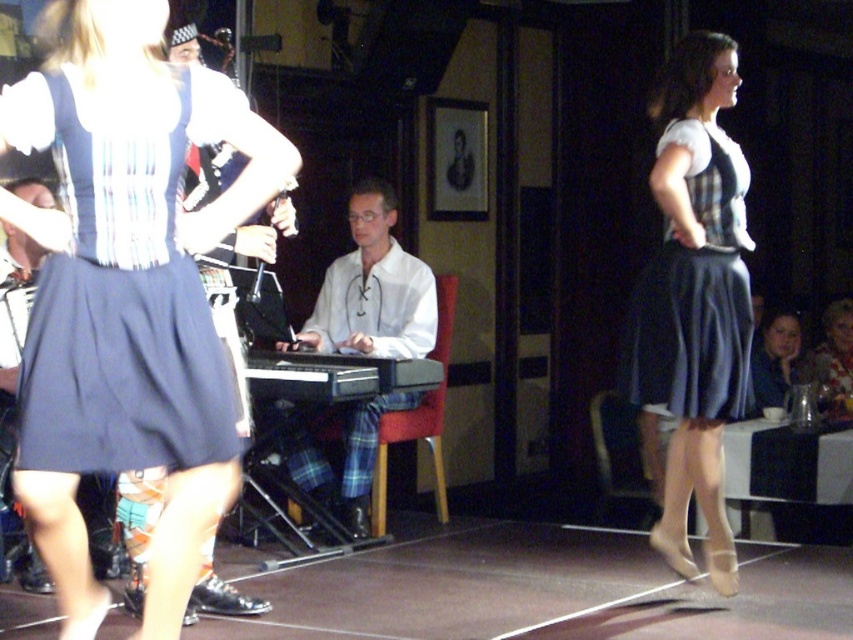
You are standing in the audience watching the dance performance. There are two points marked in the scene. The first point is at coordinates point (683,304) and the second is at point (282,365). Which point is closer to you?

Point (683,304) is closer to the viewer than point (282,365).

You are a photographer at the event and want to capture a photo where the matte black dress at right is visible above the black plastic keyboard at center. Is this possible based on their positions?

Yes, the matte black dress at right is located above the black plastic keyboard at center, so capturing such a photo is possible.

You are a photographer at the event and want to capture a photo where the black plastic keyboard at center is visible without being blocked by the floral fabric dress at right. Based on their positions, is this possible?

The black plastic keyboard at center is positioned under the floral fabric dress at right, so it might be partially or fully blocked depending on the angle. To ensure visibility, adjust the camera angle to look downward or from the side to avoid obstruction by the dress.